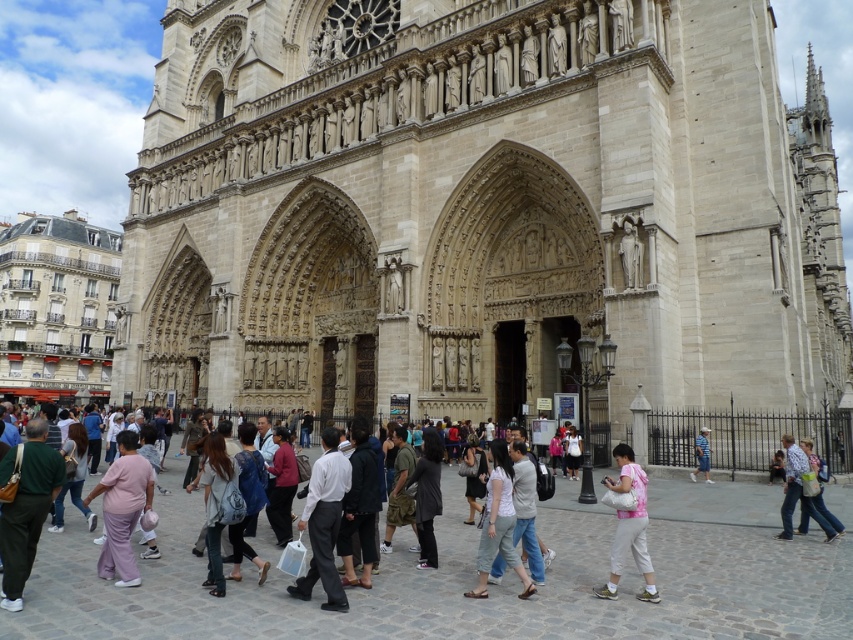
You are standing in front of the beige stone church at center and want to take a photo of the light blue jeans at center. Since the church is between you and the jeans, will you be able to capture the jeans in your photo without the church blocking them?

The beige stone church at center is further to the viewer than light blue jeans at center, meaning the church is closer to you. Since the church is between you and the jeans, it will block the view of the light blue jeans at center, so you won